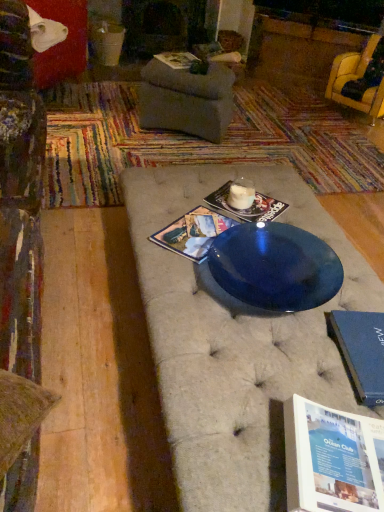
You are a GUI agent. You are given a task and a screenshot of the screen. Output one action in this format:
    pyautogui.click(x=<x>, y=<y>)
    Task: Click on the vacant area on top of matte gray ottoman at center (from a real-world perspective)
    The height and width of the screenshot is (512, 384).
    Given the screenshot: What is the action you would take?
    pyautogui.click(x=232, y=125)